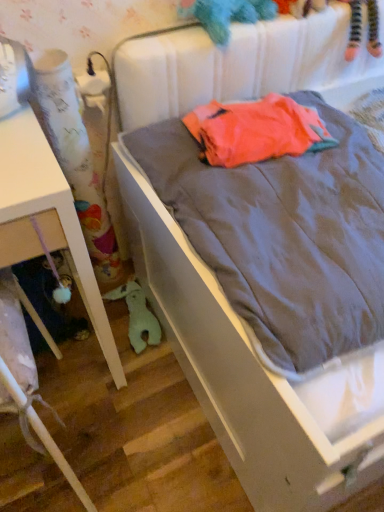
Question: Is white matte table at left turned away from white fabric curtain at left?

Choices:
 (A) no
 (B) yes

Answer: (A)

Question: Considering the relative sizes of white matte table at left and white fabric curtain at left in the image provided, is white matte table at left thinner than white fabric curtain at left?

Choices:
 (A) yes
 (B) no

Answer: (B)

Question: Can you confirm if white matte table at left is bigger than white fabric curtain at left?

Choices:
 (A) no
 (B) yes

Answer: (B)

Question: Is white matte table at left facing towards white fabric curtain at left?

Choices:
 (A) yes
 (B) no

Answer: (B)

Question: Is white matte table at left positioned before white fabric curtain at left?

Choices:
 (A) no
 (B) yes

Answer: (B)

Question: Is white matte table at left further to the viewer compared to white fabric curtain at left?

Choices:
 (A) yes
 (B) no

Answer: (B)

Question: Does green plush toy at lower left, which is the 2th toy from top to bottom, appear on the right side of fluffy teal stuffed animal at upper center, marked as the 1th toy in a right-to-left arrangement?

Choices:
 (A) no
 (B) yes

Answer: (A)

Question: Is green plush toy at lower left, the 1th toy in the bottom-to-top sequence, smaller than fluffy teal stuffed animal at upper center, which ranks as the 2th toy in back-to-front order?

Choices:
 (A) yes
 (B) no

Answer: (A)

Question: Is green plush toy at lower left, which appears as the 2th toy when viewed from the front, next to fluffy teal stuffed animal at upper center, which is the 2th toy from bottom to top?

Choices:
 (A) no
 (B) yes

Answer: (A)

Question: Is green plush toy at lower left, the 1th toy in the bottom-to-top sequence, thinner than fluffy teal stuffed animal at upper center, the 1th toy positioned from the top?

Choices:
 (A) no
 (B) yes

Answer: (A)

Question: Can you confirm if green plush toy at lower left, which is the 2th toy from top to bottom, is bigger than fluffy teal stuffed animal at upper center, which ranks as the 2th toy in back-to-front order?

Choices:
 (A) yes
 (B) no

Answer: (B)

Question: From the image's perspective, is green plush toy at lower left, which ranks as the 1th toy in back-to-front order, located beneath fluffy teal stuffed animal at upper center, the second toy when ordered from left to right?

Choices:
 (A) no
 (B) yes

Answer: (B)

Question: Can you confirm if fluffy teal stuffed animal at upper center, marked as the 1th toy in a right-to-left arrangement, is positioned to the right of neon orange fabric at center?

Choices:
 (A) no
 (B) yes

Answer: (A)